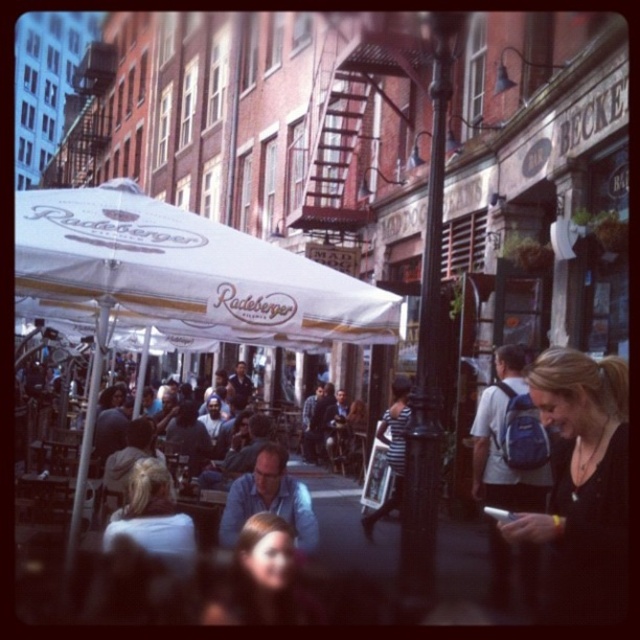
Does point (132, 202) come behind point (145, 481)?

Yes, point (132, 202) is farther from viewer.

Between point (177, 237) and point (150, 545), which one is positioned behind?

The point (177, 237) is more distant.

You are a GUI agent. You are given a task and a screenshot of the screen. Output one action in this format:
    pyautogui.click(x=<x>, y=<y>)
    Task: Click on the white fabric canopy at center
    This screenshot has width=640, height=640.
    Given the screenshot: What is the action you would take?
    pyautogui.click(x=182, y=273)

Measure the distance between point (179,336) and camera.

The distance of point (179,336) from camera is 116.47 feet.

Can you confirm if white fabric umbrella at center is taller than blonde hair at center?

Yes.

This screenshot has height=640, width=640. In order to click on white fabric umbrella at center in this screenshot , I will do `click(177, 280)`.

Measure the distance between point (x=81, y=284) and camera.

Point (x=81, y=284) and camera are 20.03 meters apart from each other.

Is point (326, 305) less distant than point (582, 516)?

No.

Locate an element on the screen. Image resolution: width=640 pixels, height=640 pixels. white fabric canopy at center is located at coordinates (182, 273).